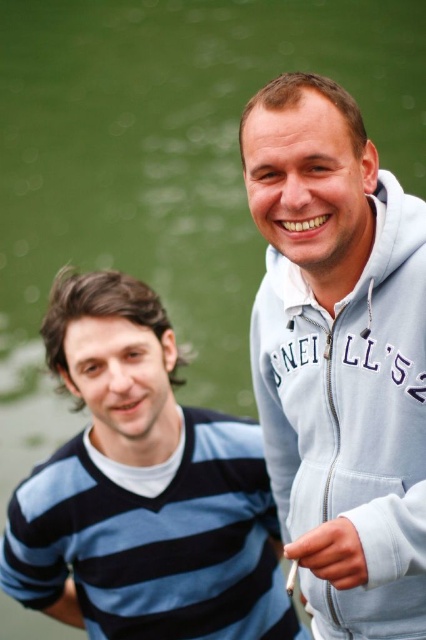
Question: Which object appears closest to the camera in this image?

Choices:
 (A) light blue zip-up hoodie at upper right
 (B) blue striped sweater at left

Answer: (A)

Question: Is light blue zip-up hoodie at upper right wider than blue striped sweater at left?

Choices:
 (A) no
 (B) yes

Answer: (A)

Question: Which of the following is the farthest from the observer?

Choices:
 (A) light blue zip-up hoodie at upper right
 (B) blue striped sweater at left

Answer: (B)

Question: Does light blue zip-up hoodie at upper right appear over blue striped sweater at left?

Choices:
 (A) yes
 (B) no

Answer: (A)

Question: From the image, what is the correct spatial relationship of light blue zip-up hoodie at upper right in relation to blue striped sweater at left?

Choices:
 (A) left
 (B) right

Answer: (B)